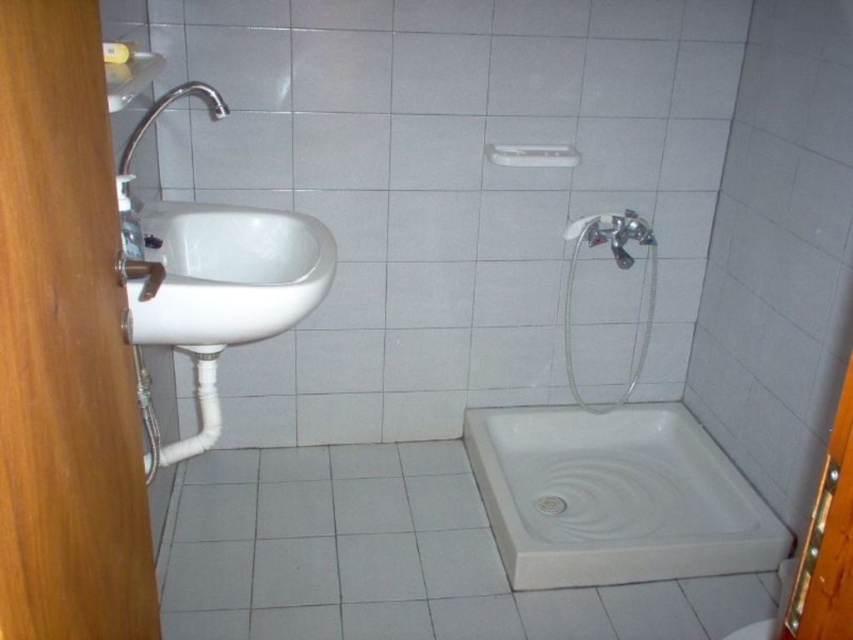
You are standing in the bathroom and want to reach a point behind the sink. Which of the two points, point (590, 490) or point (300, 305), is located behind the other?

Point (590, 490) is behind point (300, 305).